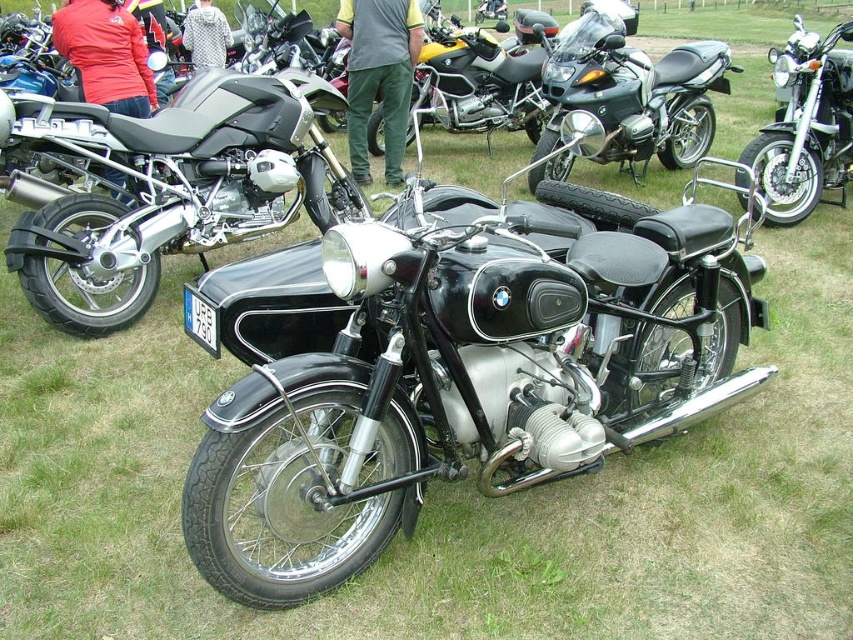
Question: Is shiny chrome motorcycle at center in front of brushed metal jacket at upper center?

Choices:
 (A) yes
 (B) no

Answer: (A)

Question: Which object is closer to the camera taking this photo?

Choices:
 (A) shiny chrome motorcycle at center
 (B) black polished motorcycle at center
 (C) brushed metal jacket at upper center

Answer: (A)

Question: Is black metallic motorcycle at center bigger than green cotton pants at center?

Choices:
 (A) no
 (B) yes

Answer: (B)

Question: Is black matte motorcycle at center smaller than black polished motorcycle at center?

Choices:
 (A) no
 (B) yes

Answer: (B)

Question: Which point is farther to the camera?

Choices:
 (A) red fabric jacket at upper left
 (B) shiny black motorcycle at center
 (C) shiny chrome motorcycle at center
 (D) brushed metal jacket at upper center

Answer: (D)

Question: Estimate the real-world distances between objects in this image. Which object is closer to the red fabric jacket at upper left?

Choices:
 (A) black matte motorcycle at center
 (B) shiny black motorcycle at center

Answer: (A)